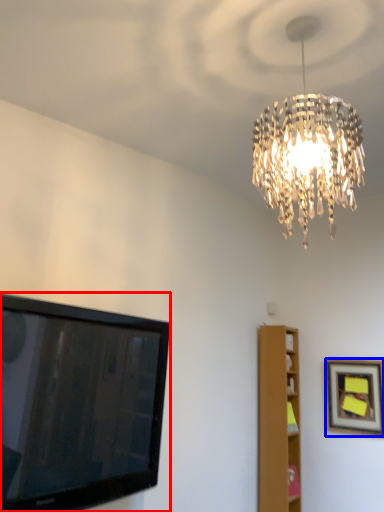
Question: Which of the following is the farthest to the observer, television (highlighted by a red box) or picture frame (highlighted by a blue box)?

Choices:
 (A) television
 (B) picture frame

Answer: (B)